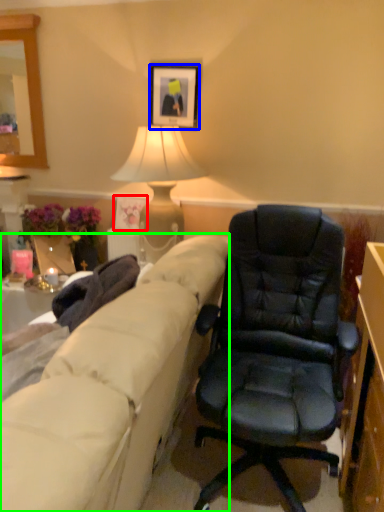
Question: Which is farther away from picture frame (highlighted by a red box)? picture frame (highlighted by a blue box) or studio couch (highlighted by a green box)?

Choices:
 (A) picture frame
 (B) studio couch

Answer: (B)